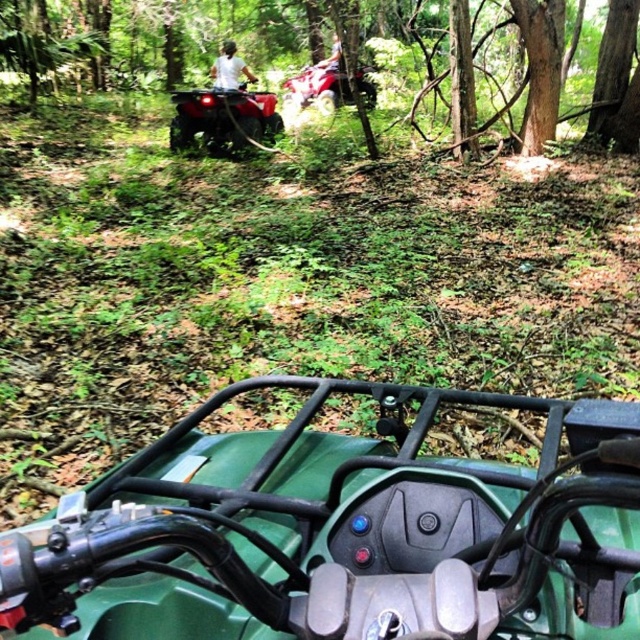
Is matte red quad bike at center wider than smooth bark tree at upper right?

Yes, matte red quad bike at center is wider than smooth bark tree at upper right.

Does point (177, 132) come closer to viewer compared to point (616, 93)?

No, it is not.

Does point (250, 99) lie behind point (609, 24)?

Yes, point (250, 99) is behind point (609, 24).

I want to click on matte red quad bike at center, so click(224, 120).

Between brown rough tree trunk at upper center and smooth bark tree at upper right, which one appears on the left side from the viewer's perspective?

Positioned to the left is brown rough tree trunk at upper center.

Locate an element on the screen. The width and height of the screenshot is (640, 640). brown rough tree trunk at upper center is located at coordinates (317, 51).

Does green matte quad bike at center appear on the left side of matte red quad bike at center?

In fact, green matte quad bike at center is to the right of matte red quad bike at center.

Between point (356, 541) and point (241, 120), which one is positioned in front?

Positioned in front is point (356, 541).

Does point (544, 484) come farther from viewer compared to point (268, 109)?

No, it is not.

What are the coordinates of `green matte quad bike at center` in the screenshot? It's located at (340, 532).